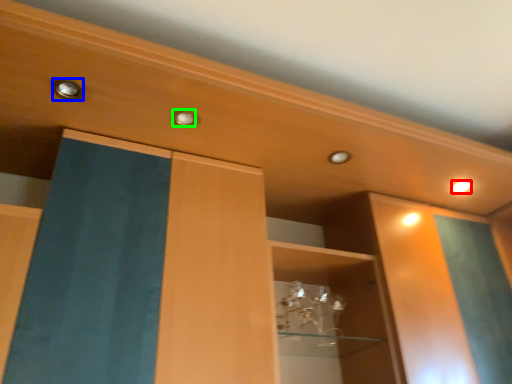
Question: Considering the real-world distances, which object is closest to lighting (highlighted by a red box)? knob (highlighted by a blue box) or knob (highlighted by a green box).

Choices:
 (A) knob
 (B) knob

Answer: (B)